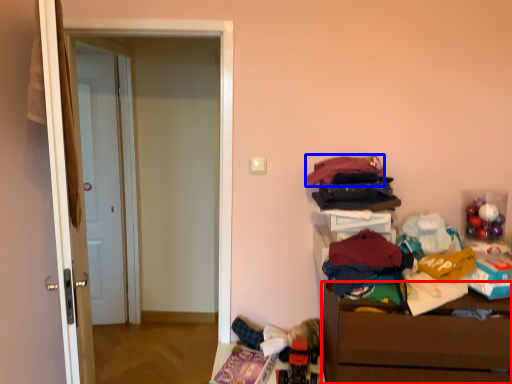
Question: Which object appears farthest to the camera in this image, chest of drawers (highlighted by a red box) or clothing (highlighted by a blue box)?

Choices:
 (A) chest of drawers
 (B) clothing

Answer: (B)